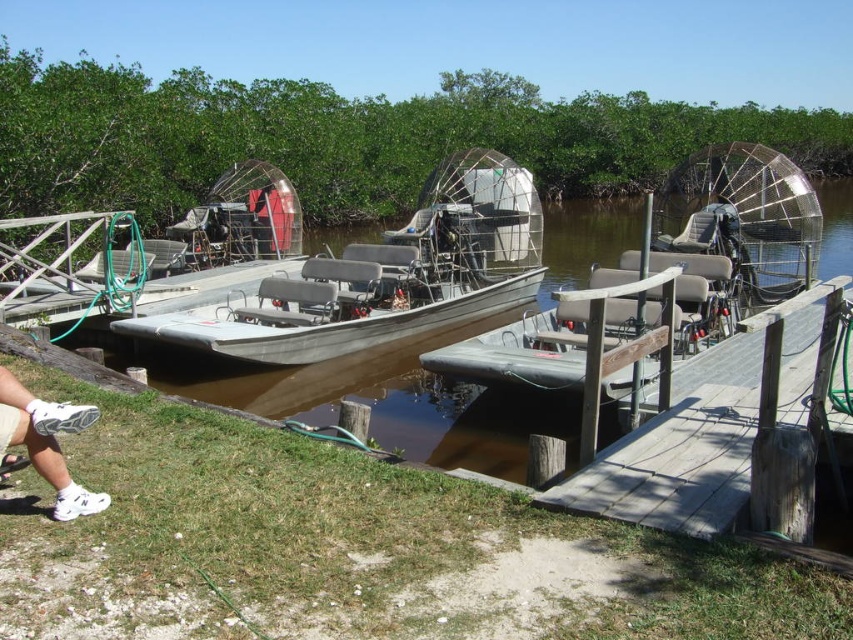
Question: Which of these objects is positioned closest to the wooden dock at center?

Choices:
 (A) silver metallic airboat at center
 (B) white fabric shoe at lower left

Answer: (B)

Question: Observing the image, what is the correct spatial positioning of gray metallic boat at center in reference to white fabric shoe at lower left?

Choices:
 (A) above
 (B) below

Answer: (A)

Question: Which of the following is the closest to the observer?

Choices:
 (A) white fabric shoe at lower left
 (B) wooden dock at center

Answer: (B)

Question: Considering the real-world distances, which object is farthest from the silver metallic airboat at center?

Choices:
 (A) gray metallic boat at center
 (B) wooden dock at center

Answer: (A)

Question: In this image, where is gray metallic boat at center located relative to white fabric shoe at lower left?

Choices:
 (A) above
 (B) below

Answer: (A)

Question: Can you confirm if silver metallic airboat at center is smaller than wooden dock at center?

Choices:
 (A) yes
 (B) no

Answer: (A)